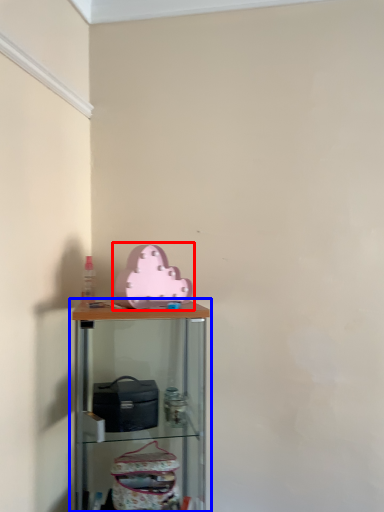
Question: Which of the following is the closest to the observer, toy (highlighted by a red box) or shelf (highlighted by a blue box)?

Choices:
 (A) toy
 (B) shelf

Answer: (B)